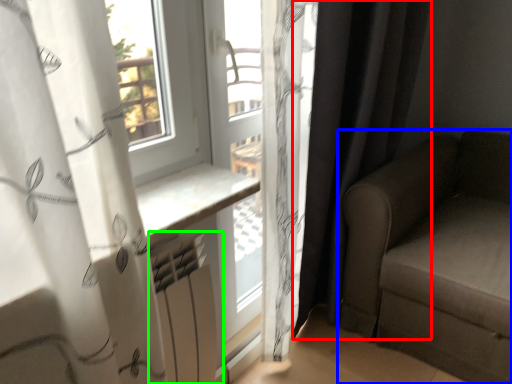
Question: Estimate the real-world distances between objects in this image. Which object is farther from curtain (highlighted by a red box), studio couch (highlighted by a blue box) or radiator (highlighted by a green box)?

Choices:
 (A) studio couch
 (B) radiator

Answer: (B)